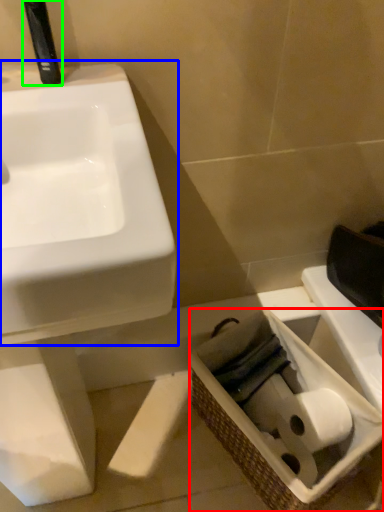
Question: Which is farther away from basket (highlighted by a red box)? sink (highlighted by a blue box) or plumbing fixture (highlighted by a green box)?

Choices:
 (A) sink
 (B) plumbing fixture

Answer: (B)